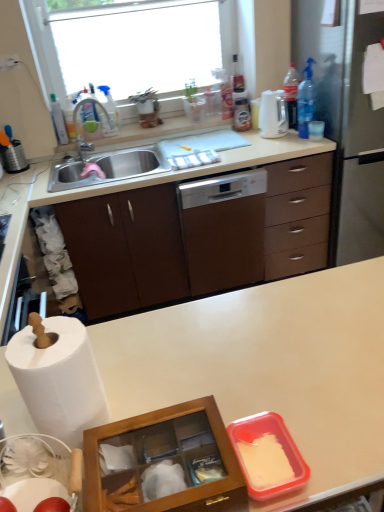
You are a GUI agent. You are given a task and a screenshot of the screen. Output one action in this format:
    pyautogui.click(x=<x>, y=<y>)
    Task: Click on the vacant region to the left of matte silver faucet at sink left
    
    Given the screenshot: What is the action you would take?
    pyautogui.click(x=73, y=161)